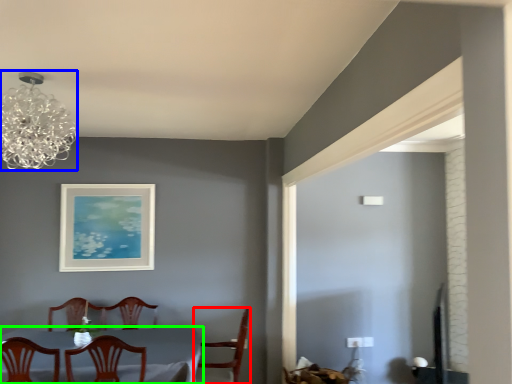
Question: Which object is the farthest from chair (highlighted by a red box)? Choose among these: lamp (highlighted by a blue box) or table (highlighted by a green box).

Choices:
 (A) lamp
 (B) table

Answer: (A)